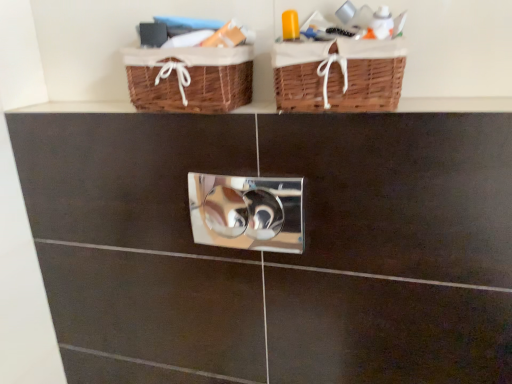
Question: Considering the relative sizes of woven brown basket at upper center, the 2th basket when ordered from right to left, and polished silver lock at center in the image provided, is woven brown basket at upper center, the 2th basket when ordered from right to left, bigger than polished silver lock at center?

Choices:
 (A) yes
 (B) no

Answer: (A)

Question: Is woven brown basket at upper center, which is counted as the first basket, starting from the left, positioned in front of polished silver lock at center?

Choices:
 (A) yes
 (B) no

Answer: (A)

Question: Can you confirm if woven brown basket at upper center, the 2th basket when ordered from right to left, is smaller than polished silver lock at center?

Choices:
 (A) no
 (B) yes

Answer: (A)

Question: Can you confirm if woven brown basket at upper center, the 2th basket when ordered from right to left, is positioned to the right of polished silver lock at center?

Choices:
 (A) no
 (B) yes

Answer: (A)

Question: Considering the relative sizes of woven brown basket at upper center, which is counted as the first basket, starting from the left, and polished silver lock at center in the image provided, is woven brown basket at upper center, which is counted as the first basket, starting from the left, wider than polished silver lock at center?

Choices:
 (A) yes
 (B) no

Answer: (A)

Question: From a real-world perspective, is woven brown basket at upper center, the 2th basket when ordered from right to left, beneath polished silver lock at center?

Choices:
 (A) no
 (B) yes

Answer: (A)

Question: Can you confirm if brown wicker baskets at upper center is wider than polished silver lock at center?

Choices:
 (A) yes
 (B) no

Answer: (A)

Question: Is polished silver lock at center a part of brown wicker baskets at upper center?

Choices:
 (A) no
 (B) yes

Answer: (A)

Question: Does brown wicker baskets at upper center appear on the right side of polished silver lock at center?

Choices:
 (A) no
 (B) yes

Answer: (A)

Question: Does brown wicker baskets at upper center have a larger size compared to polished silver lock at center?

Choices:
 (A) no
 (B) yes

Answer: (A)

Question: Does brown wicker baskets at upper center have a lesser height compared to polished silver lock at center?

Choices:
 (A) no
 (B) yes

Answer: (B)

Question: From a real-world perspective, does brown wicker baskets at upper center sit lower than polished silver lock at center?

Choices:
 (A) yes
 (B) no

Answer: (B)

Question: From a real-world perspective, is polished silver lock at center positioned over brown wicker baskets at upper center based on gravity?

Choices:
 (A) no
 (B) yes

Answer: (A)